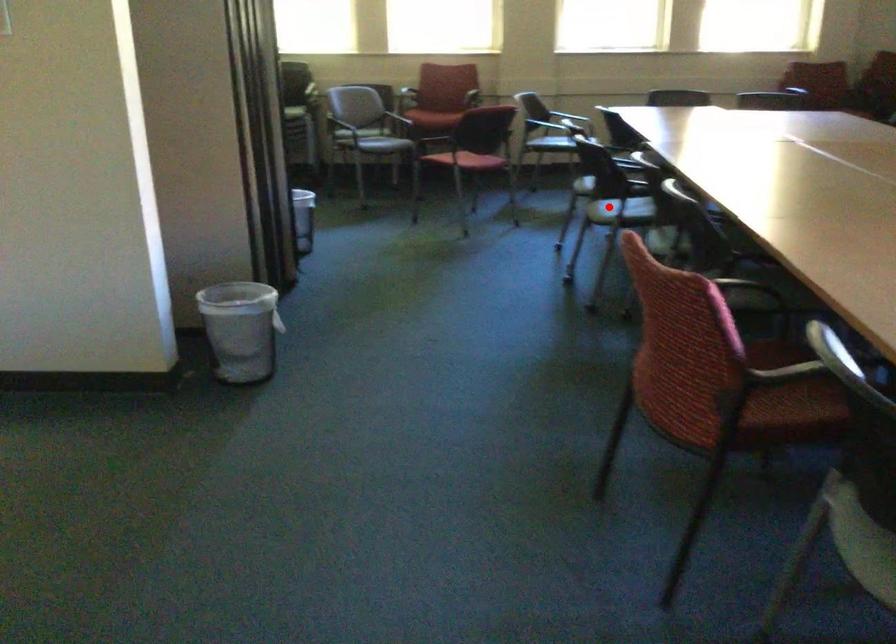
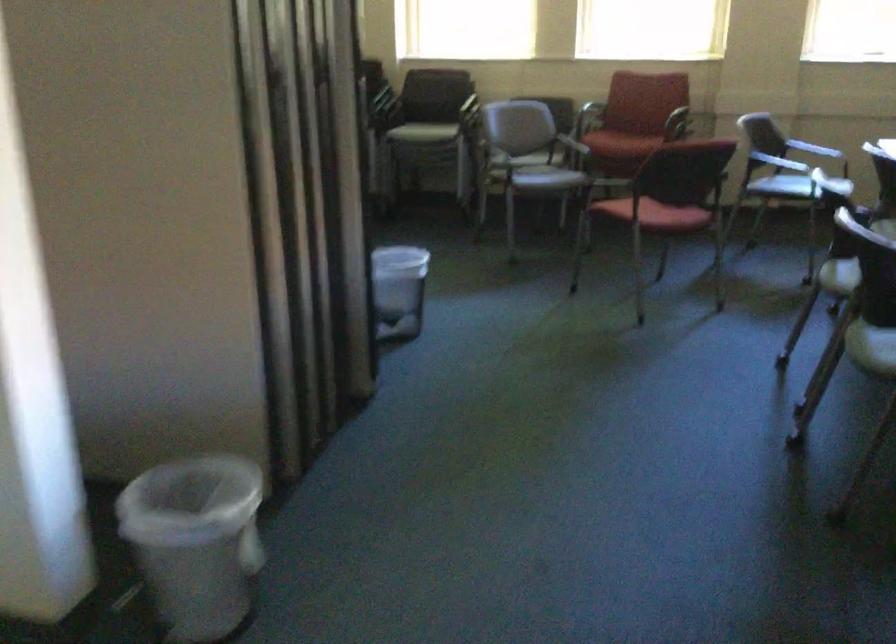
The point at the highlighted location is marked in the first image. Where is the corresponding point in the second image?

(871, 336)